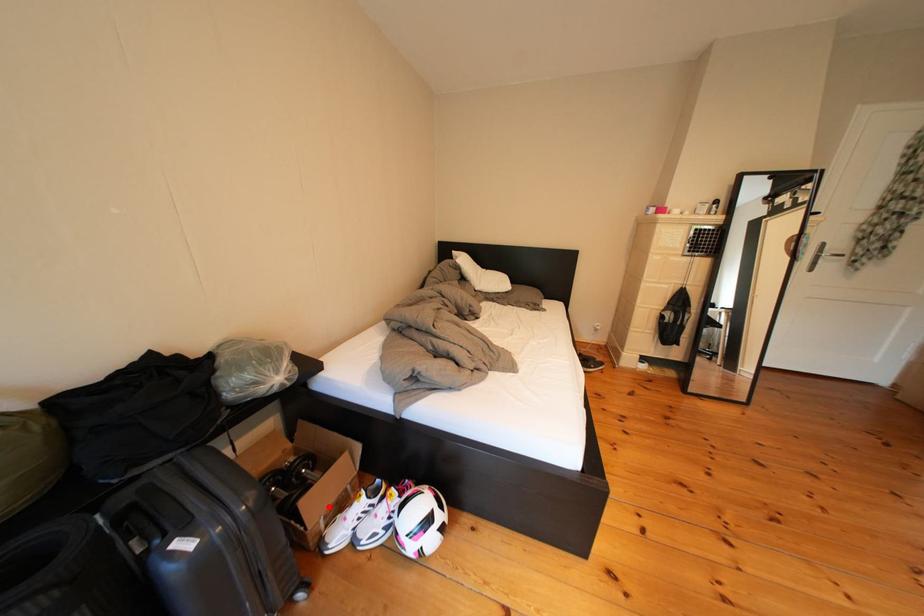
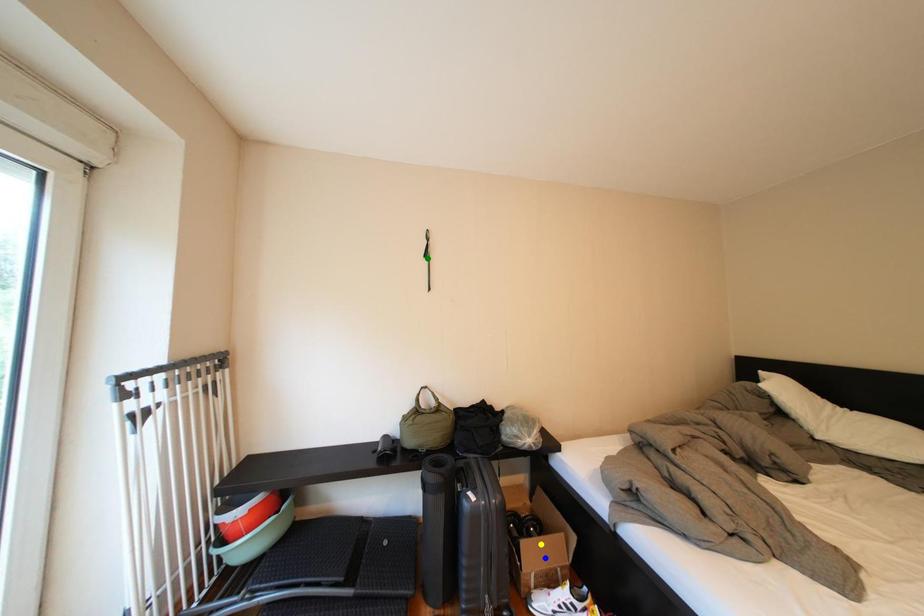
Question: I am providing you with two images of the same scene from different viewpoints. A red point is marked on the first image. You are given multiple points on the second image. Which mark in image 2 goes with the point in image 1?

Choices:
 (A) yellow point
 (B) blue point
 (C) green point

Answer: (B)